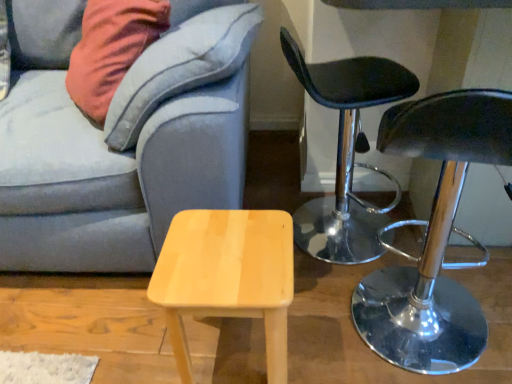
In order to click on vacant space positioned to the left of light wood stool at center in this screenshot , I will do `click(132, 340)`.